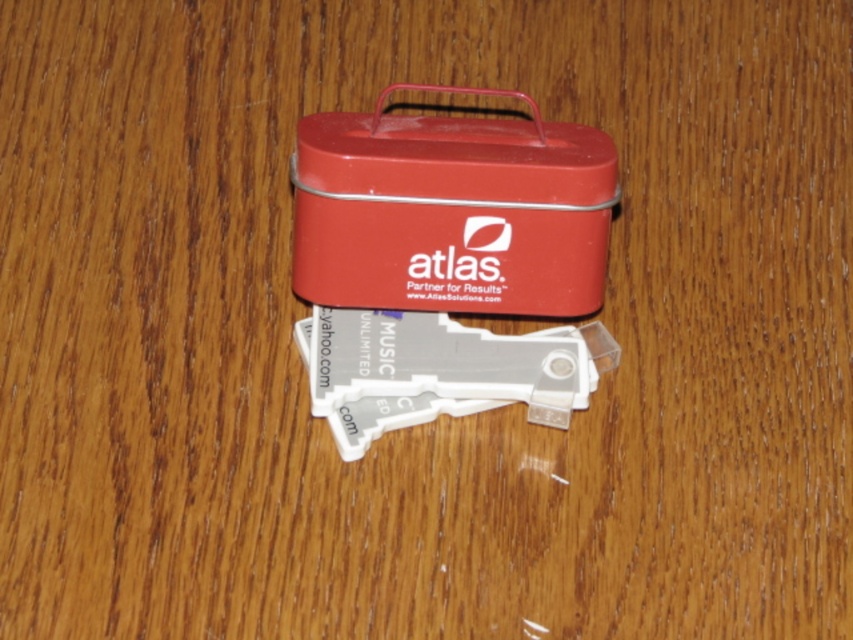
In the scene shown: You are a delivery person who needs to place a fragile item in the matte red tin at center. The item requires a minimum of 5 inches of space to fit safely. Can the item be placed in the tin if there is already a transparent plastic keychain at center inside?

The distance between the matte red tin at center and the transparent plastic keychain at center is 4.87 inches, which is less than the required 5 inches. Therefore, the fragile item cannot be safely placed in the tin with the keychain inside.